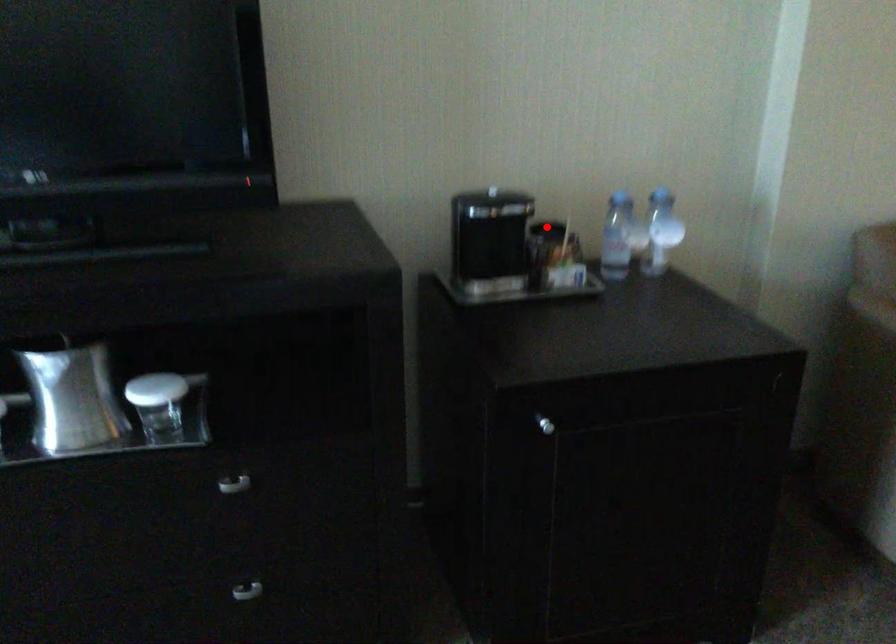
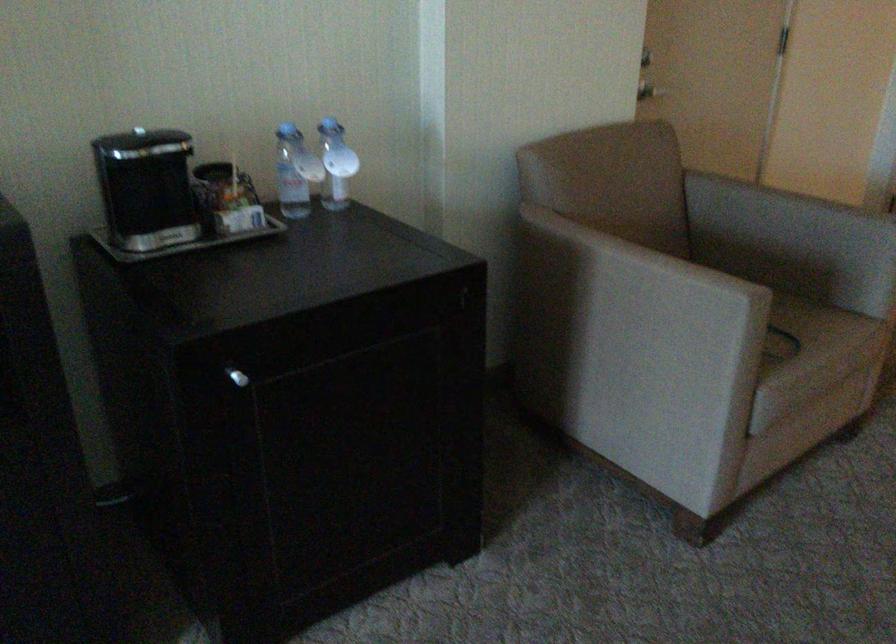
In the second image, find the point that corresponds to the highlighted location in the first image.

(212, 171)